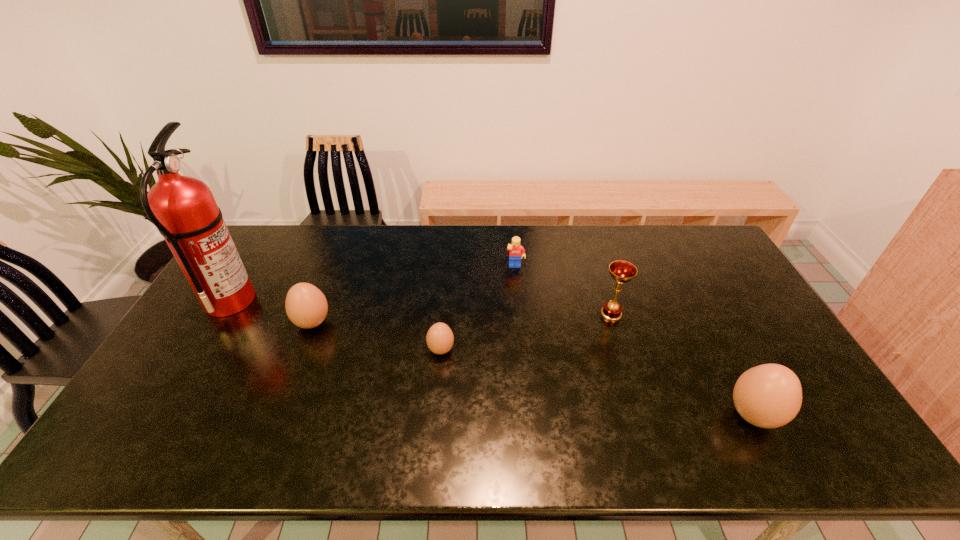
Locate an element on the screen. This screenshot has height=540, width=960. boiled egg that stands as the closest to the chalice is located at coordinates (769, 396).

You are a GUI agent. You are given a task and a screenshot of the screen. Output one action in this format:
    pyautogui.click(x=<x>, y=<y>)
    Task: Click on the boiled egg that is the closest one to the second tallest boiled egg
    The height and width of the screenshot is (540, 960).
    Given the screenshot: What is the action you would take?
    pyautogui.click(x=439, y=338)

Identify the location of vacant area that satisfies the following two spatial constraints: 1. at the nozzle of the leftmost object; 2. on the right side of the shortest boiled egg. (200, 350).

The image size is (960, 540). Identify the location of free spot that satisfies the following two spatial constraints: 1. at the nozzle of the nearest boiled egg; 2. on the right side of the fire extinguisher. (159, 415).

The height and width of the screenshot is (540, 960). I want to click on vacant space that satisfies the following two spatial constraints: 1. at the nozzle of the fire extinguisher; 2. on the back side of the shortest boiled egg, so click(200, 350).

You are a GUI agent. You are given a task and a screenshot of the screen. Output one action in this format:
    pyautogui.click(x=<x>, y=<y>)
    Task: Click on the free space that satisfies the following two spatial constraints: 1. on the face of the fifth tallest object; 2. on the right side of the nearest object
    The image size is (960, 540).
    Given the screenshot: What is the action you would take?
    pos(529,415)

Find the location of `vacant area in the image that satisfies the following two spatial constraints: 1. at the nozzle of the leftmost object; 2. on the right side of the fourth tallest object`. vacant area in the image that satisfies the following two spatial constraints: 1. at the nozzle of the leftmost object; 2. on the right side of the fourth tallest object is located at coordinates (216, 323).